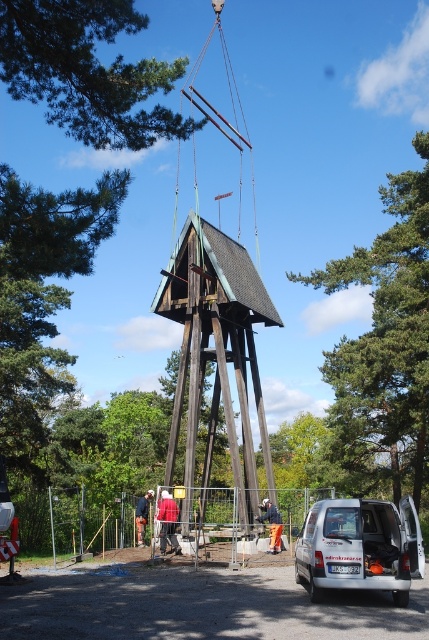
Question: Is white matte van at lower right wider than orange fabric at center?

Choices:
 (A) no
 (B) yes

Answer: (B)

Question: Which is farther from the orange fabric at center?

Choices:
 (A) dark brown wooden bell tower at center
 (B) white matte van at lower right

Answer: (B)

Question: Which point is farther to the camera?

Choices:
 (A) (277, 550)
 (B) (377, 500)
 (C) (259, 284)

Answer: (C)

Question: Which object is farther from the camera taking this photo?

Choices:
 (A) orange fabric at center
 (B) white matte van at lower right
 (C) dark brown wooden bell tower at center

Answer: (A)

Question: Does white matte van at lower right appear on the right side of orange fabric at center?

Choices:
 (A) yes
 (B) no

Answer: (A)

Question: Observing the image, what is the correct spatial positioning of dark brown wooden bell tower at center in reference to white matte van at lower right?

Choices:
 (A) below
 (B) above

Answer: (B)